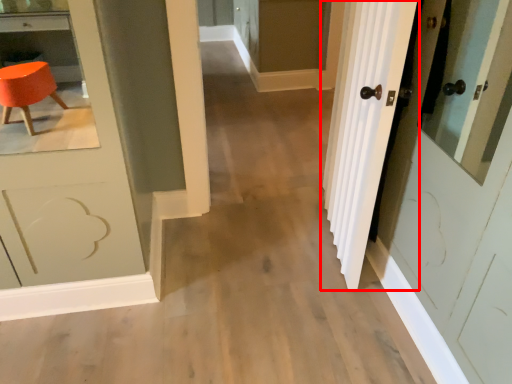
Question: From the image's perspective, where is door (annotated by the red box) located relative to screen door?

Choices:
 (A) above
 (B) below

Answer: (B)